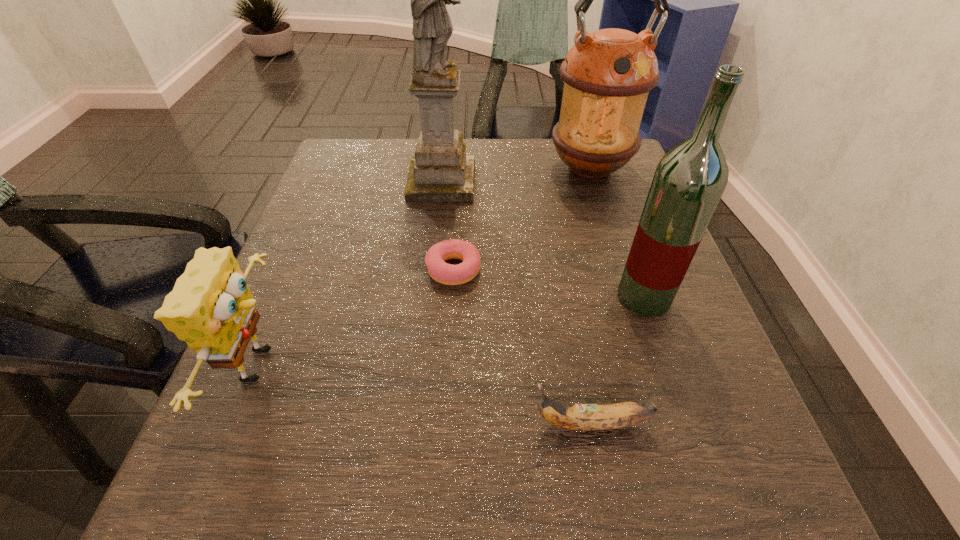
You are a GUI agent. You are given a task and a screenshot of the screen. Output one action in this format:
    pyautogui.click(x=<x>, y=<y>)
    Task: Click on the banana located at the right edge
    
    Given the screenshot: What is the action you would take?
    pyautogui.click(x=583, y=417)

Locate an element on the screen. This screenshot has height=540, width=960. object present at the far right corner is located at coordinates tap(607, 74).

Where is `vacant region at the far edge of the desktop`? Image resolution: width=960 pixels, height=540 pixels. vacant region at the far edge of the desktop is located at coordinates (510, 150).

In the image, there is a desktop. In order to click on vacant space at the left edge in this screenshot , I will do `click(228, 420)`.

The height and width of the screenshot is (540, 960). Identify the location of vacant region at the right edge of the desktop. click(x=616, y=262).

This screenshot has width=960, height=540. Identify the location of free space at the far left corner of the desktop. (372, 175).

At what (x,y) coordinates should I click in order to perform the action: click on vacant space at the far right corner. Please return your answer as a coordinate pair (x, y). The image size is (960, 540). Looking at the image, I should click on click(x=619, y=186).

This screenshot has width=960, height=540. What are the coordinates of `vacant point located between the second shortest object and the oil lamp` in the screenshot? It's located at (590, 296).

This screenshot has width=960, height=540. In order to click on vacant area that lies between the oil lamp and the liquor in this screenshot , I will do `click(617, 233)`.

The width and height of the screenshot is (960, 540). In order to click on empty space that is in between the tallest object and the liquor in this screenshot , I will do `click(542, 240)`.